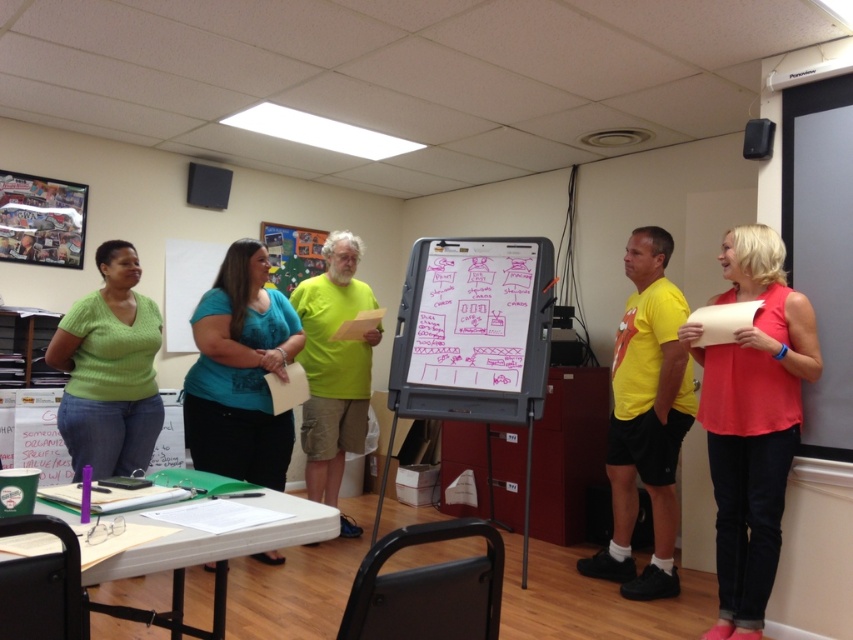
Looking at this image, does whiteboard at center have a lesser width compared to teal fabric blouse at center?

In fact, whiteboard at center might be wider than teal fabric blouse at center.

Is whiteboard at center bigger than teal fabric blouse at center?

Yes.

The image size is (853, 640). Find the location of `whiteboard at center`. whiteboard at center is located at coordinates coord(473,330).

Can you confirm if whiteboard at center is thinner than green knitted sweater at center?

Incorrect, whiteboard at center's width is not less than green knitted sweater at center's.

Is point (434, 269) closer to viewer compared to point (113, 241)?

No, (434, 269) is further to viewer.

The width and height of the screenshot is (853, 640). In order to click on whiteboard at center in this screenshot , I will do click(473, 330).

Who is positioned more to the left, matte coral blouse at right or whiteboard at center?

whiteboard at center

Can you confirm if matte coral blouse at right is bigger than whiteboard at center?

No.

Is point (717, 403) positioned behind point (549, 324)?

That is False.

At what (x,y) coordinates should I click in order to perform the action: click on matte coral blouse at right. Please return your answer as a coordinate pair (x, y). Looking at the image, I should click on (752, 420).